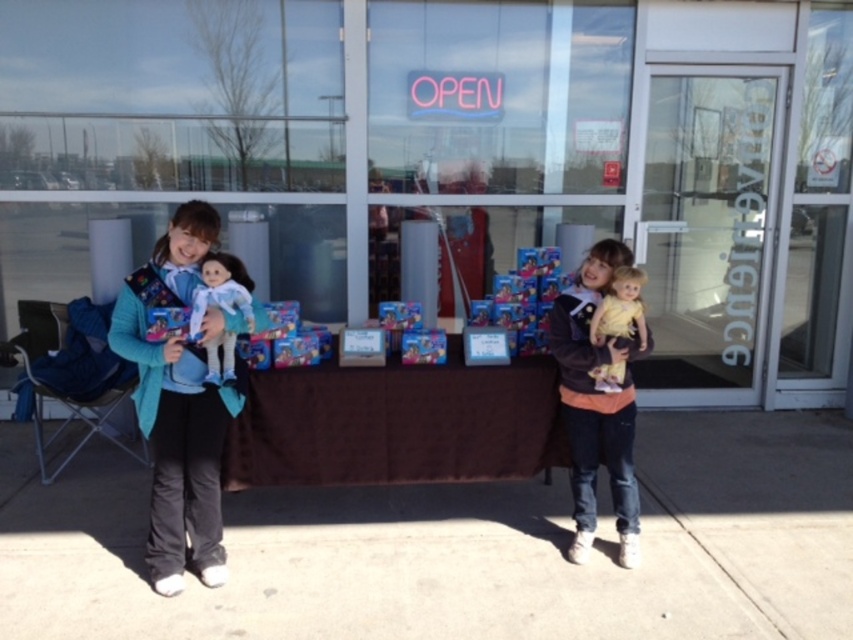
Question: Which of these objects is positioned farthest from the teal fabric carrier at left?

Choices:
 (A) velvet brown jacket at center
 (B) blue plastic toy at center

Answer: (A)

Question: Among these objects, which one is nearest to the camera?

Choices:
 (A) yellow cotton dress at center
 (B) velvet brown jacket at center

Answer: (A)

Question: Is teal fabric carrier at left above matte white doll at left?

Choices:
 (A) yes
 (B) no

Answer: (B)

Question: Among these objects, which one is farthest from the camera?

Choices:
 (A) teal fabric carrier at left
 (B) yellow cotton dress at center
 (C) velvet brown jacket at center
 (D) matte white doll at left

Answer: (C)

Question: Considering the relative positions of teal fabric carrier at left and yellow cotton dress at center in the image provided, where is teal fabric carrier at left located with respect to yellow cotton dress at center?

Choices:
 (A) below
 (B) above

Answer: (A)

Question: Is velvet brown jacket at center further to camera compared to blue plastic toy at center?

Choices:
 (A) no
 (B) yes

Answer: (A)